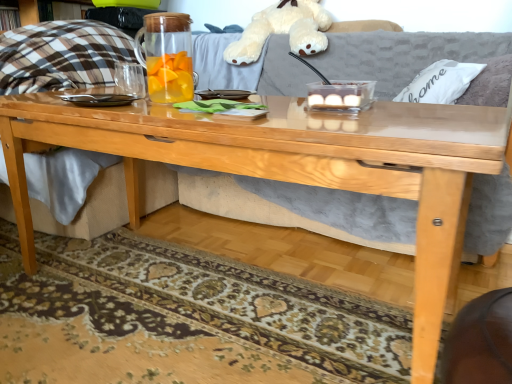
Describe the element at coordinates (183, 319) in the screenshot. I see `patterned carpet at lower center` at that location.

Describe the element at coordinates (440, 82) in the screenshot. This screenshot has width=512, height=384. I see `white fabric pillow at upper right` at that location.

Find the location of a particular element. This screenshot has height=384, width=512. white plush toy at upper center is located at coordinates (283, 30).

From the image's perspective, which one is positioned lower, white fabric pillow at upper right or transparent glass pitcher at center?

transparent glass pitcher at center appears lower in the image.

Between white fabric pillow at upper right and transparent glass pitcher at center, which one has smaller size?

transparent glass pitcher at center.

Does point (426, 85) come farther from viewer compared to point (148, 39)?

Yes, point (426, 85) is farther from viewer.

From the picture: Measure the distance between white fabric pillow at upper right and transparent glass pitcher at center.

white fabric pillow at upper right is 3.36 feet away from transparent glass pitcher at center.

Does transparent glass pitcher at center have a lesser width compared to patterned carpet at lower center?

Correct, the width of transparent glass pitcher at center is less than that of patterned carpet at lower center.

Between transparent glass pitcher at center and patterned carpet at lower center, which one has larger size?

patterned carpet at lower center is bigger.

Is transparent glass pitcher at center situated inside patterned carpet at lower center or outside?

transparent glass pitcher at center is not inside patterned carpet at lower center, it's outside.

Considering the positions of objects transparent glass pitcher at center and patterned carpet at lower center in the image provided, who is in front, transparent glass pitcher at center or patterned carpet at lower center?

patterned carpet at lower center is more forward.

Is white fabric pillow at upper right situated inside white plush toy at upper center or outside?

The correct answer is: outside.

From a real-world perspective, is white fabric pillow at upper right beneath white plush toy at upper center?

Yes, from a real-world perspective, white fabric pillow at upper right is below white plush toy at upper center.

Considering the sizes of white fabric pillow at upper right and white plush toy at upper center in the image, is white fabric pillow at upper right wider or thinner than white plush toy at upper center?

white fabric pillow at upper right is thinner than white plush toy at upper center.

Are white fabric pillow at upper right and patterned carpet at lower center located far from each other?

Yes.

Is the position of white fabric pillow at upper right less distant than that of patterned carpet at lower center?

No, white fabric pillow at upper right is behind patterned carpet at lower center.

Is patterned carpet at lower center a part of white fabric pillow at upper right?

Definitely not — patterned carpet at lower center is not inside white fabric pillow at upper right.

Would you say white plush toy at upper center is to the left or to the right of patterned carpet at lower center in the picture?

white plush toy at upper center is positioned on patterned carpet at lower center's right side.

In the scene shown: Measure the distance between white plush toy at upper center and patterned carpet at lower center.

The distance of white plush toy at upper center from patterned carpet at lower center is 1.52 meters.

Considering the sizes of objects white plush toy at upper center and patterned carpet at lower center in the image provided, who is shorter, white plush toy at upper center or patterned carpet at lower center?

patterned carpet at lower center.

Is transparent glass pitcher at center directly adjacent to white plush toy at upper center?

transparent glass pitcher at center and white plush toy at upper center are not in contact.

Which object is closer to the camera, transparent glass pitcher at center or white plush toy at upper center?

transparent glass pitcher at center is closer to the camera.

Would you say transparent glass pitcher at center is outside white plush toy at upper center?

transparent glass pitcher at center lies outside white plush toy at upper center's area.

Locate an element on the screen. toy on the right of transparent glass pitcher at center is located at coordinates (283, 30).

Which object is further away from the camera taking this photo, white plush toy at upper center or transparent glass pitcher at center?

white plush toy at upper center is more distant.

Are white plush toy at upper center and transparent glass pitcher at center making contact?

No, white plush toy at upper center is not next to transparent glass pitcher at center.

At what (x,y) coordinates should I click in order to perform the action: click on pillow to the right of transparent glass pitcher at center. Please return your answer as a coordinate pair (x, y). Looking at the image, I should click on (440, 82).

Locate an element on the screen. This screenshot has height=384, width=512. beverage behind the patterned carpet at lower center is located at coordinates (167, 56).

Considering their positions, is white fabric pillow at upper right positioned further to transparent glass pitcher at center than white plush toy at upper center?

Based on the image, white plush toy at upper center appears to be further to transparent glass pitcher at center.

Looking at the image, which one is located closer to transparent glass pitcher at center, patterned carpet at lower center or white plush toy at upper center?

patterned carpet at lower center lies closer to transparent glass pitcher at center than the other object.

Estimate the real-world distances between objects in this image. Which object is closer to white fabric pillow at upper right, transparent glass pitcher at center or patterned carpet at lower center?

transparent glass pitcher at center is positioned closer to the anchor white fabric pillow at upper right.

Estimate the real-world distances between objects in this image. Which object is closer to patterned carpet at lower center, transparent glass pitcher at center or white plush toy at upper center?

transparent glass pitcher at center is positioned closer to the anchor patterned carpet at lower center.

Considering their positions, is patterned carpet at lower center positioned closer to white plush toy at upper center than white fabric pillow at upper right?

Among the two, white fabric pillow at upper right is located nearer to white plush toy at upper center.

Based on their spatial positions, is white plush toy at upper center or white fabric pillow at upper right further from patterned carpet at lower center?

The object further to patterned carpet at lower center is white plush toy at upper center.

When comparing their distances from transparent glass pitcher at center, does patterned carpet at lower center or white fabric pillow at upper right seem further?

white fabric pillow at upper right.

Looking at this image, considering their positions, is transparent glass pitcher at center positioned further to white plush toy at upper center than white fabric pillow at upper right?

transparent glass pitcher at center.

You are a GUI agent. You are given a task and a screenshot of the screen. Output one action in this format:
    pyautogui.click(x=<x>, y=<y>)
    Task: Click on the pillow between patterned carpet at lower center and white plush toy at upper center in the front-back direction
    This screenshot has width=512, height=384.
    Given the screenshot: What is the action you would take?
    pyautogui.click(x=440, y=82)

Where is `pillow positioned between transparent glass pitcher at center and white plush toy at upper center from near to far`? Image resolution: width=512 pixels, height=384 pixels. pillow positioned between transparent glass pitcher at center and white plush toy at upper center from near to far is located at coordinates (440, 82).

Locate an element on the screen. The height and width of the screenshot is (384, 512). beverage located between patterned carpet at lower center and white plush toy at upper center in the depth direction is located at coordinates (167, 56).

I want to click on beverage between patterned carpet at lower center and white fabric pillow at upper right in the horizontal direction, so click(x=167, y=56).